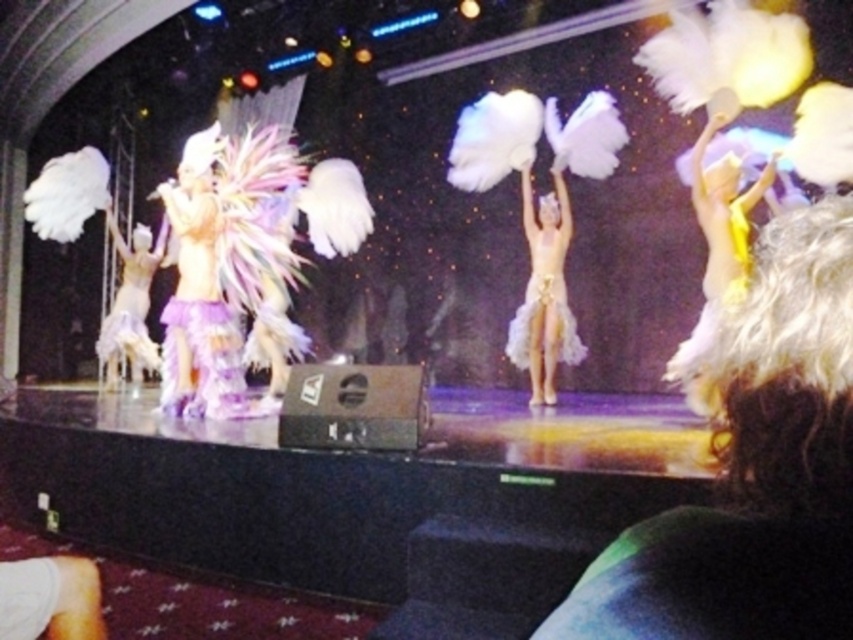
Is point (819, 579) less distant than point (564, 211)?

That is True.

Measure the distance between white curly hair at upper right and white feathered costume at center.

5.83 meters

Who is more distant from viewer, (x=827, y=481) or (x=524, y=339)?

Positioned behind is point (x=524, y=339).

I want to click on white curly hair at upper right, so click(755, 472).

Between white feathered costume at center and white feathered costume at left, which one appears on the left side from the viewer's perspective?

From the viewer's perspective, white feathered costume at left appears more on the left side.

Based on the photo, can you confirm if white feathered costume at center is bigger than white feathered costume at left?

Actually, white feathered costume at center might be smaller than white feathered costume at left.

I want to click on white feathered costume at center, so click(544, 291).

Between white curly hair at upper right and white feathered costume at left, which one has more height?

Standing taller between the two is white feathered costume at left.

Is point (791, 246) less distant than point (126, 252)?

Yes, point (791, 246) is closer to viewer.

Locate an element on the screen. This screenshot has height=640, width=853. white curly hair at upper right is located at coordinates (755, 472).